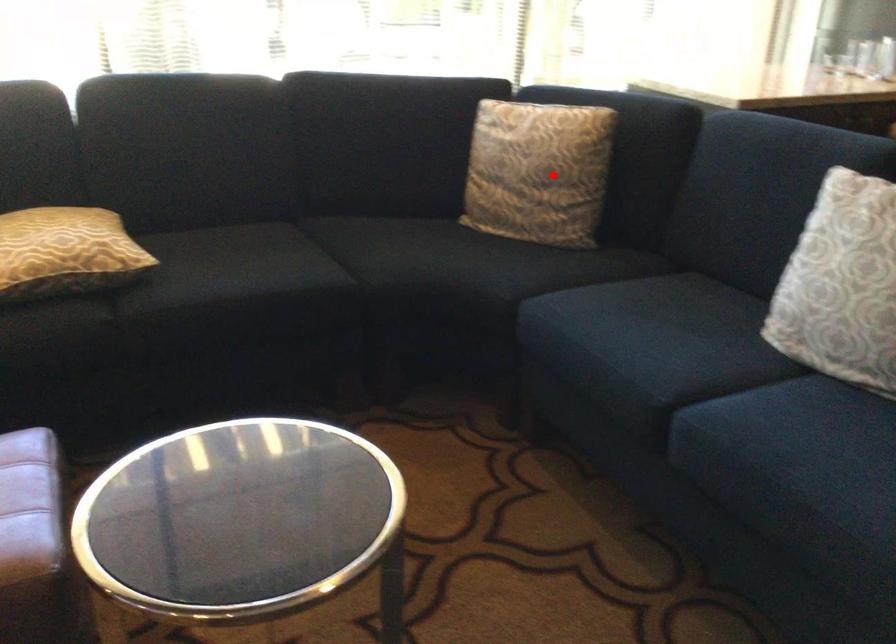
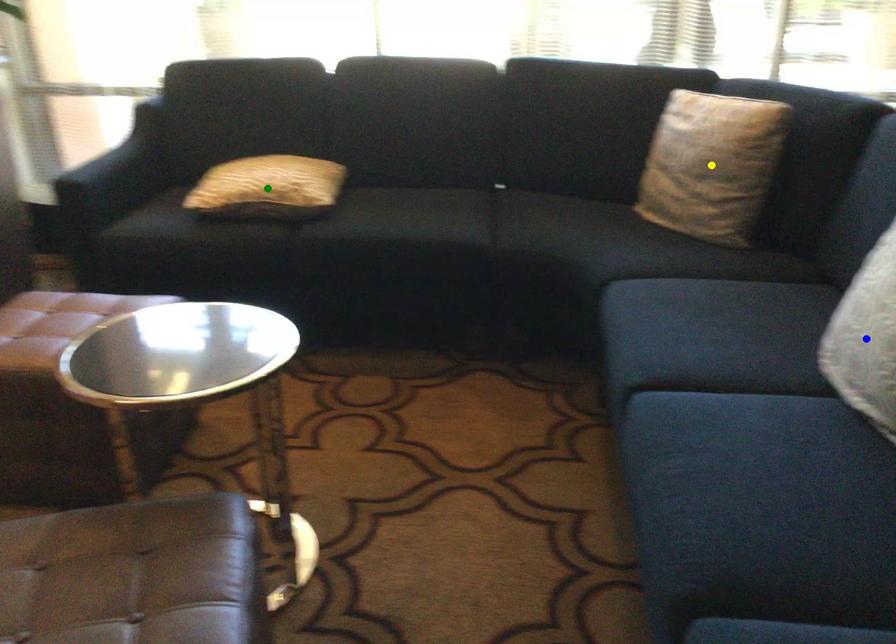
Question: I am providing you with two images of the same scene from different viewpoints. A red point is marked on the first image. You are given multiple points on the second image. Which point in image 2 represents the same 3d spot as the red point in image 1?

Choices:
 (A) yellow point
 (B) green point
 (C) blue point

Answer: (A)